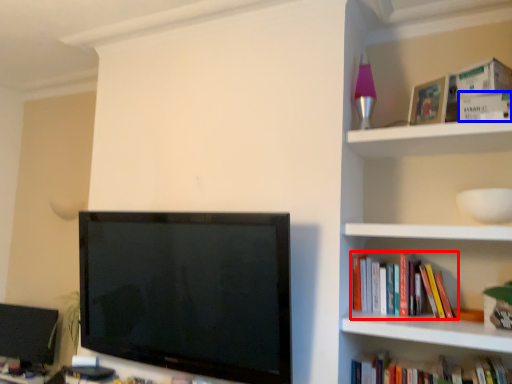
Question: Which of the following is the closest to the observer, book (highlighted by a red box) or paperback book (highlighted by a blue box)?

Choices:
 (A) book
 (B) paperback book

Answer: (B)